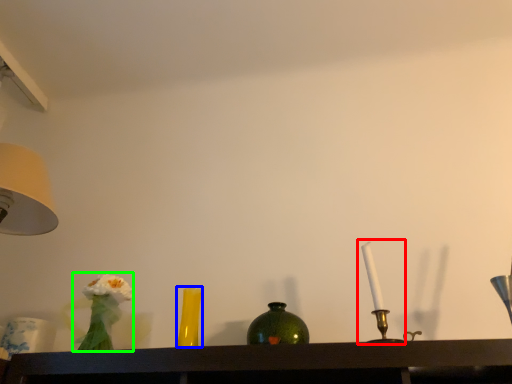
Question: Which object is the closest to the candle holder (highlighted by a red box)? Choose among these: vase (highlighted by a blue box) or floral arrangement (highlighted by a green box).

Choices:
 (A) vase
 (B) floral arrangement

Answer: (A)